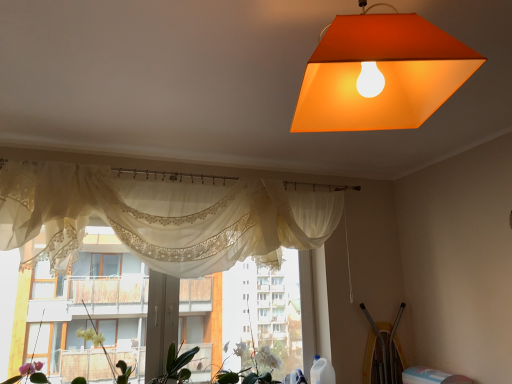
Describe the element at coordinates (251, 366) in the screenshot. This screenshot has height=384, width=512. I see `white matte plant at center, the 1th plant viewed from the right` at that location.

What is the approximate height of sheer white curtain at center?

sheer white curtain at center is 27.06 inches tall.

How much space does green leafy plant at center, which appears as the 3th plant when viewed from the right, occupy vertically?

The height of green leafy plant at center, which appears as the 3th plant when viewed from the right, is 21.50 inches.

Image resolution: width=512 pixels, height=384 pixels. Describe the element at coordinates (380, 74) in the screenshot. I see `orange matte lampshade at upper center` at that location.

The height and width of the screenshot is (384, 512). I want to click on sheer lace curtains at center, so click(x=85, y=302).

What do you see at coordinates (176, 365) in the screenshot? The width and height of the screenshot is (512, 384). I see `green matte plant at lower center, which ranks as the second plant in left-to-right order` at bounding box center [176, 365].

At what (x,y) coordinates should I click in order to perform the action: click on white matte plant at center, the 1th plant viewed from the right. Please return your answer as a coordinate pair (x, y). The image size is (512, 384). Looking at the image, I should click on (251, 366).

From the picture: Is the surface of sheer white curtain at center in direct contact with orange matte lampshade at upper center?

No, sheer white curtain at center is not next to orange matte lampshade at upper center.

Considering the relative sizes of sheer white curtain at center and orange matte lampshade at upper center in the image provided, is sheer white curtain at center shorter than orange matte lampshade at upper center?

No.

Identify the location of lamp lying above the sheer white curtain at center (from the image's perspective). (380, 74).

Could you measure the distance between green leafy plant at center, the first plant when ordered from left to right, and white matte plant at center, the 1th plant viewed from the right?

green leafy plant at center, the first plant when ordered from left to right, and white matte plant at center, the 1th plant viewed from the right, are 31.28 inches apart.

Is point (88, 332) in front of point (242, 371)?

Yes, it is.

Based on the photo, is green leafy plant at center, which appears as the 3th plant when viewed from the right, oriented away from white matte plant at center, the 1th plant viewed from the right?

green leafy plant at center, which appears as the 3th plant when viewed from the right, is not turned away from white matte plant at center, the 1th plant viewed from the right.

Do you think green leafy plant at center, which appears as the 3th plant when viewed from the right, is within white matte plant at center, placed as the 3th plant when sorted from left to right, or outside of it?

green leafy plant at center, which appears as the 3th plant when viewed from the right, is spatially situated outside white matte plant at center, placed as the 3th plant when sorted from left to right.

Which is correct: sheer lace curtains at center is inside orange matte lampshade at upper center, or outside of it?

sheer lace curtains at center lies outside orange matte lampshade at upper center.

Considering the sizes of objects sheer lace curtains at center and orange matte lampshade at upper center in the image provided, who is shorter, sheer lace curtains at center or orange matte lampshade at upper center?

Standing shorter between the two is orange matte lampshade at upper center.

Which object is further away from the camera, sheer lace curtains at center or orange matte lampshade at upper center?

sheer lace curtains at center is further from the camera.

Considering the positions of points (138, 267) and (448, 74), is point (138, 267) closer to camera compared to point (448, 74)?

No, it is behind (448, 74).

Considering their positions, is white matte plant at center, the 1th plant viewed from the right, located in front of or behind sheer lace curtains at center?

white matte plant at center, the 1th plant viewed from the right, is behind sheer lace curtains at center.

Does white matte plant at center, placed as the 3th plant when sorted from left to right, have a lesser height compared to sheer lace curtains at center?

Correct, white matte plant at center, placed as the 3th plant when sorted from left to right, is not as tall as sheer lace curtains at center.

Is white matte plant at center, the 1th plant viewed from the right, looking in the opposite direction of sheer lace curtains at center?

Yes, white matte plant at center, the 1th plant viewed from the right,'s orientation is away from sheer lace curtains at center.

From the image's perspective, who appears lower, white matte plant at center, the 1th plant viewed from the right, or sheer lace curtains at center?

white matte plant at center, the 1th plant viewed from the right.

From the picture: Considering the relative sizes of sheer white curtain at center and green leafy plant at center, which appears as the 3th plant when viewed from the right, in the image provided, is sheer white curtain at center thinner than green leafy plant at center, which appears as the 3th plant when viewed from the right,?

Correct, the width of sheer white curtain at center is less than that of green leafy plant at center, which appears as the 3th plant when viewed from the right.

Is green leafy plant at center, the first plant when ordered from left to right, at the back of sheer white curtain at center?

No, sheer white curtain at center's orientation is not away from green leafy plant at center, the first plant when ordered from left to right.

Between point (205, 195) and point (114, 379), which one is positioned behind?

The point (205, 195) is behind.

Are sheer white curtain at center and green leafy plant at center, the first plant when ordered from left to right, making contact?

sheer white curtain at center is not next to green leafy plant at center, the first plant when ordered from left to right, and they're not touching.

Considering the points (227, 379) and (127, 381), which point is behind, point (227, 379) or point (127, 381)?

Positioned behind is point (227, 379).

Who is smaller, white matte plant at center, placed as the 3th plant when sorted from left to right, or green leafy plant at center, the first plant when ordered from left to right?

With smaller size is green leafy plant at center, the first plant when ordered from left to right.

Can you tell me how much white matte plant at center, placed as the 3th plant when sorted from left to right, and green leafy plant at center, which appears as the 3th plant when viewed from the right, differ in facing direction?

There is a 5.48-degree angle between the facing directions of white matte plant at center, placed as the 3th plant when sorted from left to right, and green leafy plant at center, which appears as the 3th plant when viewed from the right.

Between white matte plant at center, the 1th plant viewed from the right, and green leafy plant at center, the first plant when ordered from left to right, which one appears on the left side from the viewer's perspective?

Positioned to the left is green leafy plant at center, the first plant when ordered from left to right.

Can you confirm if green leafy plant at center, which appears as the 3th plant when viewed from the right, is positioned to the left of green matte plant at lower center, the 2th plant viewed from the right?

Correct, you'll find green leafy plant at center, which appears as the 3th plant when viewed from the right, to the left of green matte plant at lower center, the 2th plant viewed from the right.

Considering the sizes of objects green leafy plant at center, the first plant when ordered from left to right, and green matte plant at lower center, which ranks as the second plant in left-to-right order, in the image provided, who is shorter, green leafy plant at center, the first plant when ordered from left to right, or green matte plant at lower center, which ranks as the second plant in left-to-right order,?

Standing shorter between the two is green matte plant at lower center, which ranks as the second plant in left-to-right order.

In the scene shown: Relative to green matte plant at lower center, the 2th plant viewed from the right, is green leafy plant at center, the first plant when ordered from left to right, in front or behind?

Visually, green leafy plant at center, the first plant when ordered from left to right, is located in front of green matte plant at lower center, the 2th plant viewed from the right.

This screenshot has height=384, width=512. Identify the location of lamp that is in front of the sheer white curtain at center. [x=380, y=74].

Image resolution: width=512 pixels, height=384 pixels. I want to click on plant that is the 2nd one when counting backward from the green leafy plant at center, the first plant when ordered from left to right, so click(x=251, y=366).

When comparing their distances from green matte plant at lower center, which ranks as the second plant in left-to-right order, does green leafy plant at center, which appears as the 3th plant when viewed from the right, or sheer lace curtains at center seem closer?

Among the two, green leafy plant at center, which appears as the 3th plant when viewed from the right, is located nearer to green matte plant at lower center, which ranks as the second plant in left-to-right order.

When comparing their distances from green matte plant at lower center, the 2th plant viewed from the right, does sheer white curtain at center or orange matte lampshade at upper center seem further?

orange matte lampshade at upper center lies further to green matte plant at lower center, the 2th plant viewed from the right, than the other object.

From the image, which object appears to be farther from green matte plant at lower center, the 2th plant viewed from the right, sheer lace curtains at center or sheer white curtain at center?

Among the two, sheer white curtain at center is located further to green matte plant at lower center, the 2th plant viewed from the right.

From the image, which object appears to be farther from sheer white curtain at center, green leafy plant at center, which appears as the 3th plant when viewed from the right, or orange matte lampshade at upper center?

orange matte lampshade at upper center is further to sheer white curtain at center.

Estimate the real-world distances between objects in this image. Which object is closer to sheer lace curtains at center, green matte plant at lower center, which ranks as the second plant in left-to-right order, or sheer white curtain at center?

sheer white curtain at center is positioned closer to the anchor sheer lace curtains at center.

Looking at the image, which one is located closer to white matte plant at center, the 1th plant viewed from the right, green leafy plant at center, which appears as the 3th plant when viewed from the right, or green matte plant at lower center, which ranks as the second plant in left-to-right order?

green matte plant at lower center, which ranks as the second plant in left-to-right order, lies closer to white matte plant at center, the 1th plant viewed from the right, than the other object.

Looking at the image, which one is located further to white matte plant at center, placed as the 3th plant when sorted from left to right, sheer lace curtains at center or green leafy plant at center, the first plant when ordered from left to right?

sheer lace curtains at center is positioned further to the anchor white matte plant at center, placed as the 3th plant when sorted from left to right.

Estimate the real-world distances between objects in this image. Which object is closer to sheer lace curtains at center, green matte plant at lower center, the 2th plant viewed from the right, or green leafy plant at center, the first plant when ordered from left to right?

Based on the image, green leafy plant at center, the first plant when ordered from left to right, appears to be nearer to sheer lace curtains at center.

Where is `curtain between orange matte lampshade at upper center and green leafy plant at center, the first plant when ordered from left to right, along the z-axis`? curtain between orange matte lampshade at upper center and green leafy plant at center, the first plant when ordered from left to right, along the z-axis is located at coordinates (159, 217).

Where is `plant positioned between orange matte lampshade at upper center and sheer lace curtains at center from near to far`? plant positioned between orange matte lampshade at upper center and sheer lace curtains at center from near to far is located at coordinates 106,355.

Where is `bay window between sheer white curtain at center and green matte plant at lower center, which ranks as the second plant in left-to-right order, from top to bottom`? bay window between sheer white curtain at center and green matte plant at lower center, which ranks as the second plant in left-to-right order, from top to bottom is located at coordinates (85, 302).

At what (x,y) coordinates should I click in order to perform the action: click on curtain between orange matte lampshade at upper center and green matte plant at lower center, the 2th plant viewed from the right, along the z-axis. Please return your answer as a coordinate pair (x, y). The height and width of the screenshot is (384, 512). Looking at the image, I should click on (159, 217).